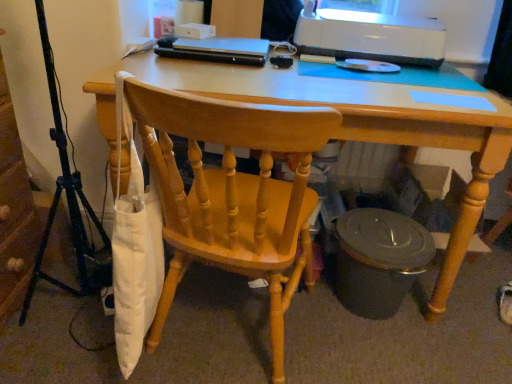
What are the coordinates of `empty space that is in between wooden chair at center and light wood desk at center` in the screenshot? It's located at (362, 349).